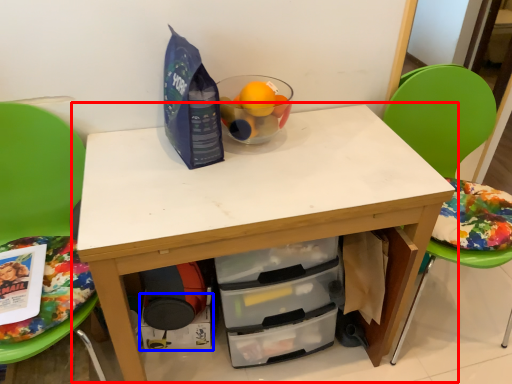
Question: Which point is further to the camera, table (highlighted by a red box) or drawer (highlighted by a blue box)?

Choices:
 (A) table
 (B) drawer

Answer: (B)